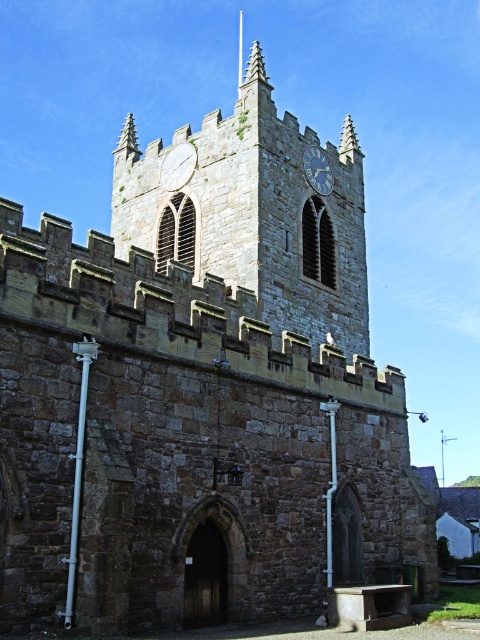
Question: Estimate the real-world distances between objects in this image. Which object is closer to the stone clock tower at center?

Choices:
 (A) blue stone clock at upper center
 (B) stone clock at center

Answer: (B)

Question: Which object is positioned farthest from the stone clock at center?

Choices:
 (A) blue stone clock at upper center
 (B) stone clock tower at center

Answer: (A)

Question: Which of the following is the farthest from the observer?

Choices:
 (A) stone clock at center
 (B) blue stone clock at upper center

Answer: (B)

Question: Does stone clock tower at center appear over blue stone clock at upper center?

Choices:
 (A) yes
 (B) no

Answer: (B)

Question: Is stone clock tower at center below stone clock at center?

Choices:
 (A) yes
 (B) no

Answer: (A)

Question: From the image, what is the correct spatial relationship of stone clock tower at center in relation to blue stone clock at upper center?

Choices:
 (A) above
 (B) below

Answer: (B)